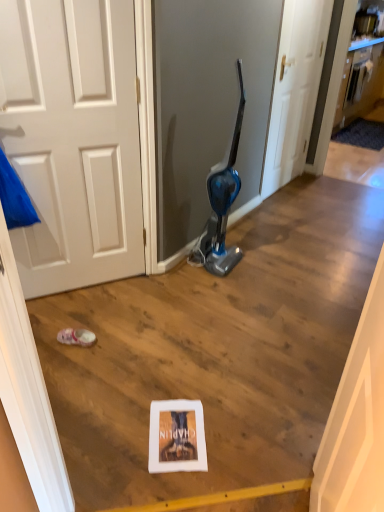
Find the location of a particular element. The height and width of the screenshot is (512, 384). vacant area to the right of pink fabric shoe at lower left is located at coordinates (109, 353).